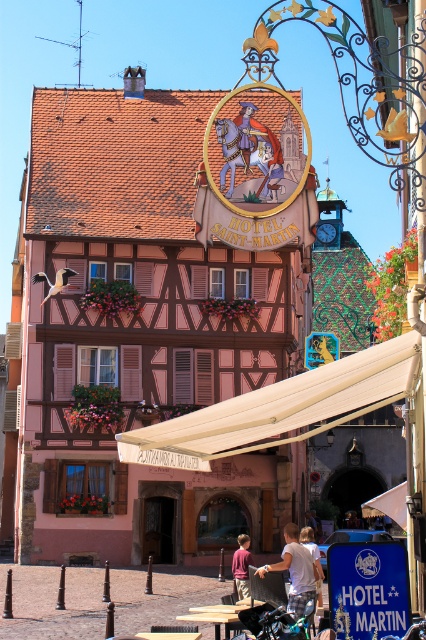
You are a customer at Hotel Saint Martin and see two shirts hanging on a rack in the lobby. The shirts are the maroon shirt at center and the white cotton shirt at center. Which shirt is shorter?

The maroon shirt at center is shorter than the white cotton shirt at center.

You are a traveler standing in front of the Hotel Saint Martin in the European town. You notice a beige fabric canopy at center and a white cotton shirt at center. Which object is taller?

The beige fabric canopy at center is taller than the white cotton shirt at center.

You are a traveler standing in front of the Hotel Saint Martin in the European town. You notice two shirts hanging on a rack nearby. The white cotton shirt at lower center and the maroon shirt at center. Which shirt is taller?

The white cotton shirt at lower center is taller than the maroon shirt at center.